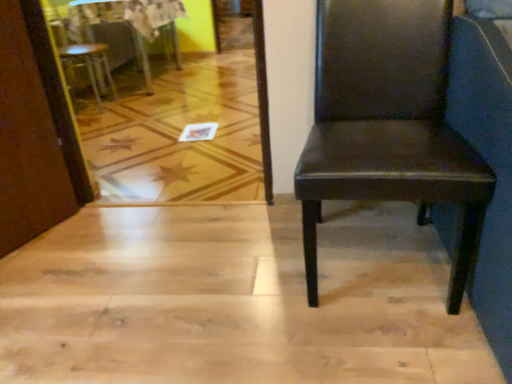
What are the coordinates of `free space in front of matte brown leather chair at right, which appears as the 1th chair when viewed from the front` in the screenshot? It's located at (376, 347).